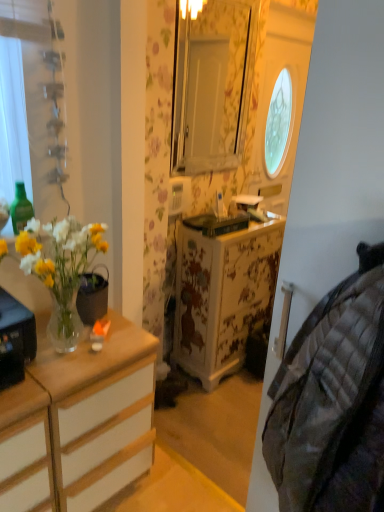
Question: Can you confirm if green glass bottle at left is shorter than clear glass vase at left?

Choices:
 (A) yes
 (B) no

Answer: (A)

Question: Would you say clear glass vase at left is part of green glass bottle at left's contents?

Choices:
 (A) no
 (B) yes

Answer: (A)

Question: From the image's perspective, would you say green glass bottle at left is shown under clear glass vase at left?

Choices:
 (A) yes
 (B) no

Answer: (B)

Question: Does green glass bottle at left lie behind clear glass vase at left?

Choices:
 (A) yes
 (B) no

Answer: (A)

Question: Is green glass bottle at left with clear glass vase at left?

Choices:
 (A) no
 (B) yes

Answer: (A)

Question: Considering the relative sizes of green glass bottle at left and clear glass vase at left in the image provided, is green glass bottle at left bigger than clear glass vase at left?

Choices:
 (A) no
 (B) yes

Answer: (A)

Question: Does white wood dresser at left, which is counted as the second cabinetry, starting from the left, have a lesser height compared to clear glass vase at left?

Choices:
 (A) yes
 (B) no

Answer: (B)

Question: Does white wood dresser at left, the first cabinetry viewed from the right, come in front of clear glass vase at left?

Choices:
 (A) yes
 (B) no

Answer: (B)

Question: Is white wood dresser at left, which is counted as the second cabinetry, starting from the left, aimed at clear glass vase at left?

Choices:
 (A) yes
 (B) no

Answer: (B)

Question: Is white wood dresser at left, the first cabinetry viewed from the right, positioned far away from clear glass vase at left?

Choices:
 (A) no
 (B) yes

Answer: (A)

Question: Considering the relative sizes of white wood dresser at left, which is counted as the second cabinetry, starting from the left, and clear glass vase at left in the image provided, is white wood dresser at left, which is counted as the second cabinetry, starting from the left, wider than clear glass vase at left?

Choices:
 (A) no
 (B) yes

Answer: (B)

Question: Considering the relative sizes of white wood dresser at left, the first cabinetry viewed from the right, and clear glass vase at left in the image provided, is white wood dresser at left, the first cabinetry viewed from the right, smaller than clear glass vase at left?

Choices:
 (A) no
 (B) yes

Answer: (A)

Question: Does plaid fabric quilt at right turn towards clear glass vase at left?

Choices:
 (A) yes
 (B) no

Answer: (B)